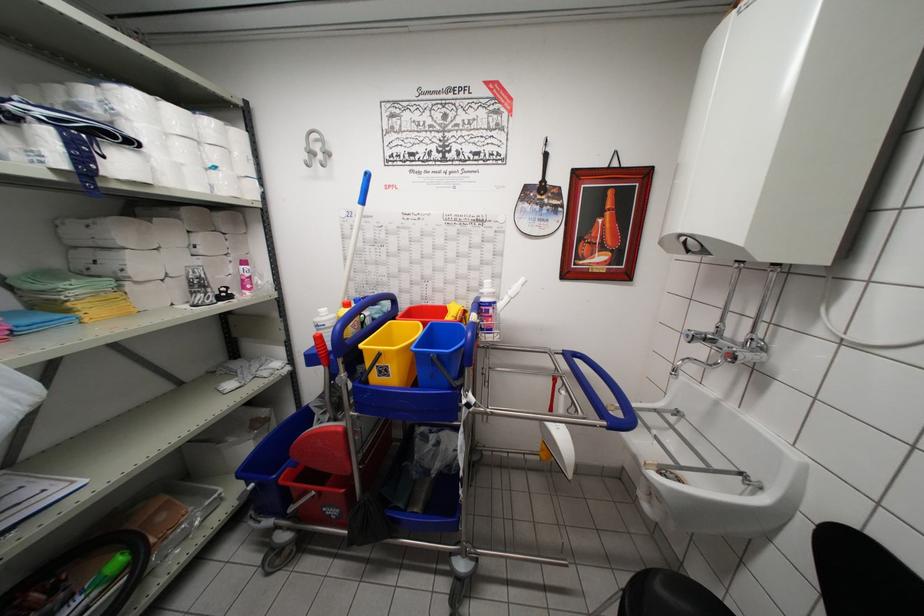
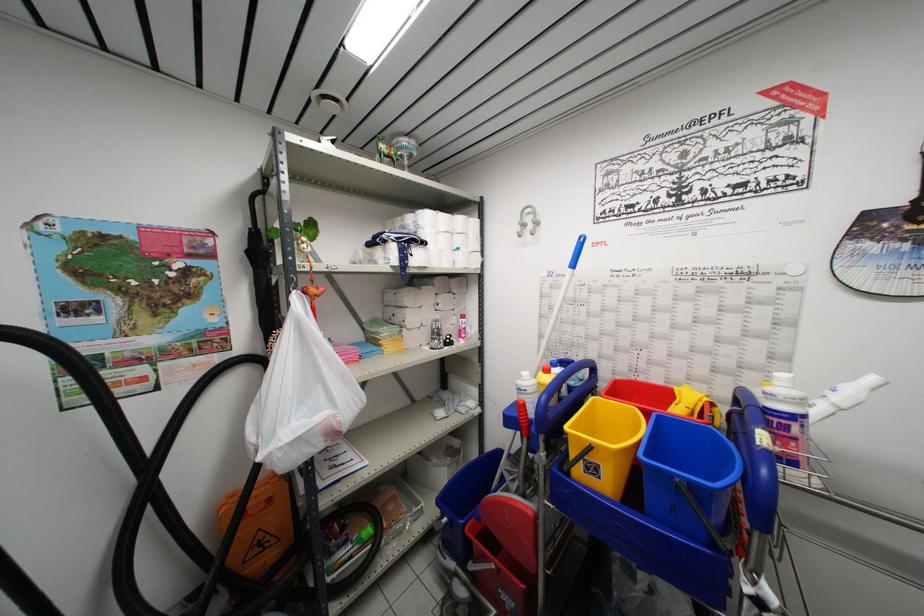
Question: Based on the continuous images, in which direction is the camera rotating? Reply with the corresponding letter.

Choices:
 (A) Left
 (B) Right
 (C) Up
 (D) Down

Answer: (A)